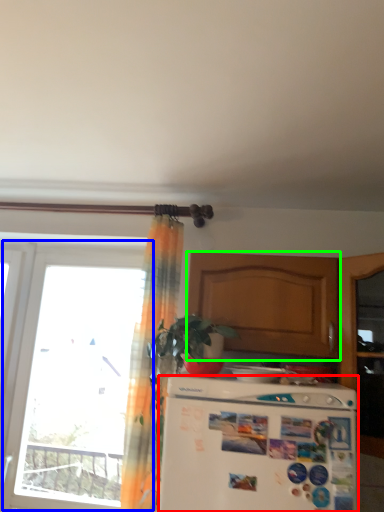
Question: Which object is positioned farthest from refrigerator (highlighted by a red box)? Select from window (highlighted by a blue box) and cabinetry (highlighted by a green box).

Choices:
 (A) window
 (B) cabinetry

Answer: (A)